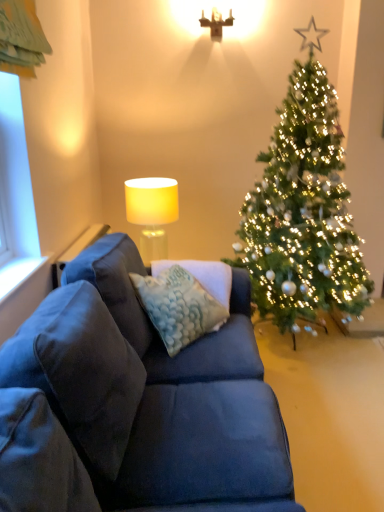
Question: Is green textured christmas tree at right wider or thinner than textured blue pillow at center?

Choices:
 (A) thin
 (B) wide

Answer: (B)

Question: Relative to textured blue pillow at center, is green textured christmas tree at right in front or behind?

Choices:
 (A) front
 (B) behind

Answer: (B)

Question: Considering the real-world distances, which object is closest to the white fabric lampshade at upper center?

Choices:
 (A) textured blue pillow at center
 (B) white painted wood at left
 (C) green textured christmas tree at right
 (D) matte white lampshade at upper center

Answer: (A)

Question: Based on their relative distances, which object is farther from the green textured christmas tree at right?

Choices:
 (A) white painted wood at left
 (B) white fabric lampshade at upper center
 (C) textured blue pillow at center
 (D) matte white lampshade at upper center

Answer: (A)